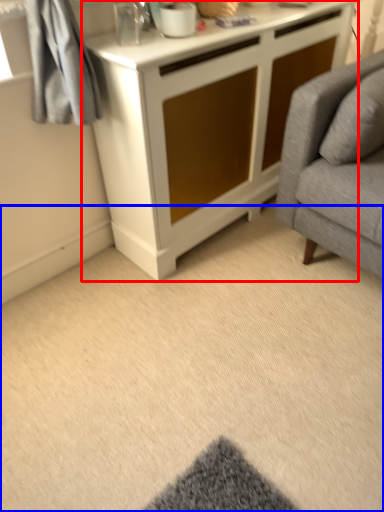
Question: Which object appears farthest to the camera in this image, cabinetry (highlighted by a red box) or plain (highlighted by a blue box)?

Choices:
 (A) cabinetry
 (B) plain

Answer: (A)